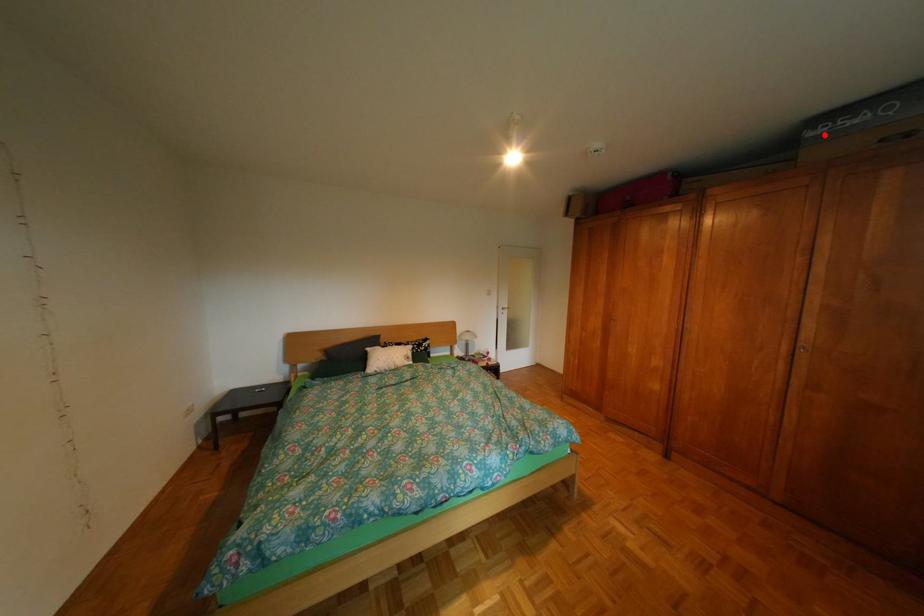
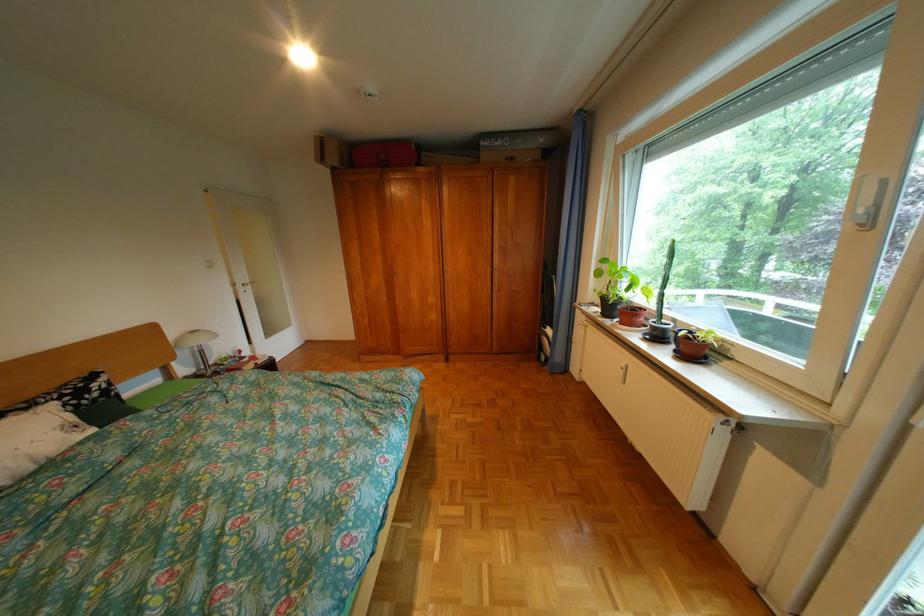
Where in the second image is the point corresponding to the highlighted location from the first image?

(497, 145)